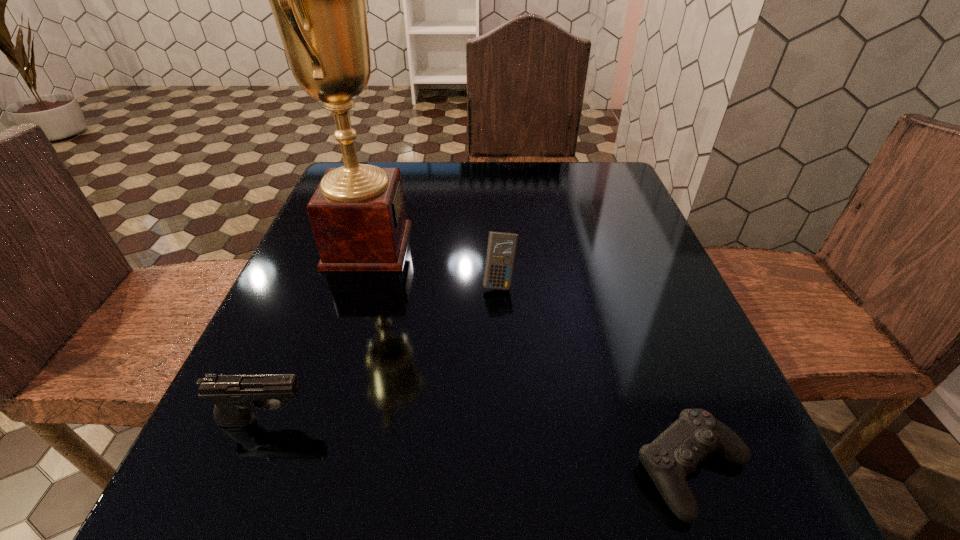
The height and width of the screenshot is (540, 960). In the image, there is a desktop. What are the coordinates of `vacant area at the near right corner` in the screenshot? It's located at (712, 461).

This screenshot has height=540, width=960. Identify the location of free space between the calculator and the rightmost object. (596, 376).

The width and height of the screenshot is (960, 540). In order to click on unoccupied position between the tallest object and the rightmost object in this screenshot , I will do `click(530, 357)`.

The height and width of the screenshot is (540, 960). I want to click on free space between the tallest object and the third object from left to right, so click(x=434, y=264).

Identify the location of empty space between the rightmost object and the pistol. This screenshot has height=540, width=960. (479, 444).

At what (x,y) coordinates should I click in order to perform the action: click on empty location between the control and the second object from right to left. Please return your answer as a coordinate pair (x, y). Looking at the image, I should click on (596, 376).

In order to click on free space between the control and the third object from left to right in this screenshot , I will do `click(596, 376)`.

Find the location of `empty space between the tallest object and the calculator`. empty space between the tallest object and the calculator is located at coordinates (434, 264).

The image size is (960, 540). In order to click on free space between the calculator and the rightmost object in this screenshot , I will do `click(596, 376)`.

Identify the location of free point between the control and the calculator. The image size is (960, 540). (596, 376).